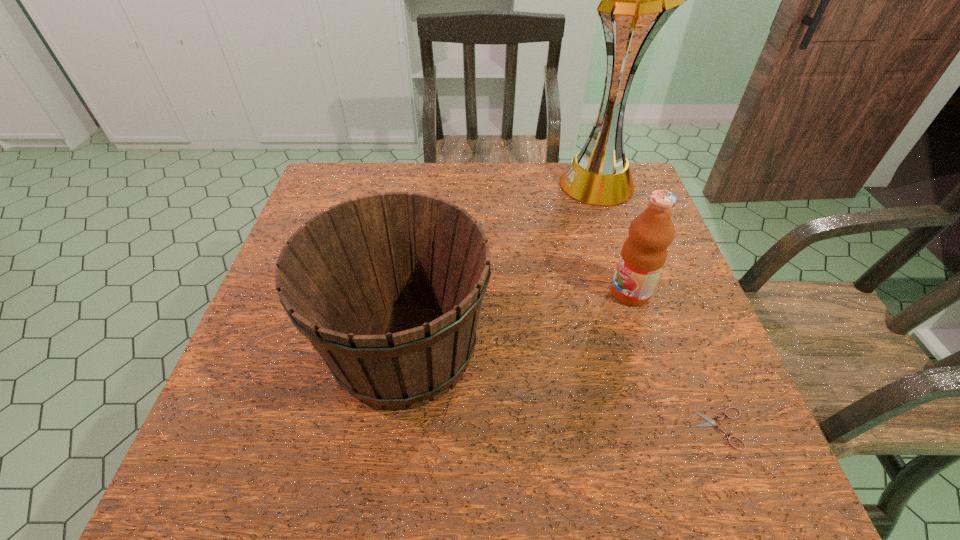
Find the location of `object that is at the near right corner`. object that is at the near right corner is located at coordinates (710, 422).

This screenshot has width=960, height=540. Find the location of `vacant area at the far edge of the desktop`. vacant area at the far edge of the desktop is located at coordinates (420, 192).

Locate an element on the screen. The image size is (960, 540). free region at the near edge is located at coordinates (318, 476).

Identify the location of vacant position at the left edge of the desktop. (310, 361).

Locate an element on the screen. Image resolution: width=960 pixels, height=540 pixels. free location at the right edge of the desktop is located at coordinates (685, 326).

Locate an element on the screen. The height and width of the screenshot is (540, 960). vacant space at the far left corner of the desktop is located at coordinates coord(357,167).

Where is `free space between the fruit juice and the shears`? Image resolution: width=960 pixels, height=540 pixels. free space between the fruit juice and the shears is located at coordinates (676, 361).

Find the location of a particular element. free space between the fruit juice and the wine bucket is located at coordinates (517, 321).

At what (x,y) coordinates should I click in order to perform the action: click on vacant point located between the shears and the fruit juice. Please return your answer as a coordinate pair (x, y). Looking at the image, I should click on (676, 361).

Find the location of a particular element. The image size is (960, 540). vacant area that lies between the shortest object and the leftmost object is located at coordinates (563, 389).